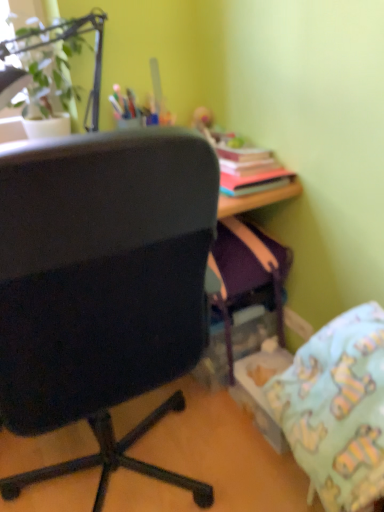
Question: Does light blue fabric pillow at lower right appear on the left side of black fabric chair at left?

Choices:
 (A) no
 (B) yes

Answer: (A)

Question: From the image's perspective, would you say light blue fabric pillow at lower right is positioned over black fabric chair at left?

Choices:
 (A) yes
 (B) no

Answer: (B)

Question: Does light blue fabric pillow at lower right have a greater width compared to black fabric chair at left?

Choices:
 (A) yes
 (B) no

Answer: (B)

Question: Could you tell me if light blue fabric pillow at lower right is facing black fabric chair at left?

Choices:
 (A) yes
 (B) no

Answer: (B)

Question: From the image's perspective, is light blue fabric pillow at lower right under black fabric chair at left?

Choices:
 (A) no
 (B) yes

Answer: (B)

Question: From a real-world perspective, is light blue fabric pillow at lower right located higher than black fabric chair at left?

Choices:
 (A) yes
 (B) no

Answer: (B)

Question: Is green leafy plant at upper left completely or partially inside light blue fabric pillow at lower right?

Choices:
 (A) no
 (B) yes

Answer: (A)

Question: Considering the relative sizes of light blue fabric pillow at lower right and green leafy plant at upper left in the image provided, is light blue fabric pillow at lower right shorter than green leafy plant at upper left?

Choices:
 (A) no
 (B) yes

Answer: (B)

Question: Does light blue fabric pillow at lower right appear on the right side of green leafy plant at upper left?

Choices:
 (A) no
 (B) yes

Answer: (B)

Question: Is green leafy plant at upper left at the back of light blue fabric pillow at lower right?

Choices:
 (A) yes
 (B) no

Answer: (B)

Question: From a real-world perspective, is light blue fabric pillow at lower right on top of green leafy plant at upper left?

Choices:
 (A) no
 (B) yes

Answer: (A)

Question: Is light blue fabric pillow at lower right taller than green leafy plant at upper left?

Choices:
 (A) no
 (B) yes

Answer: (A)

Question: Would you say light blue fabric pillow at lower right is part of black fabric chair at left's contents?

Choices:
 (A) yes
 (B) no

Answer: (B)